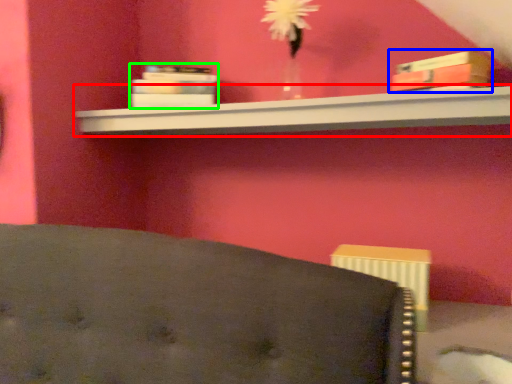
Question: Considering the real-world distances, which object is farthest from shelf (highlighted by a red box)? book (highlighted by a blue box) or book (highlighted by a green box)?

Choices:
 (A) book
 (B) book

Answer: (A)